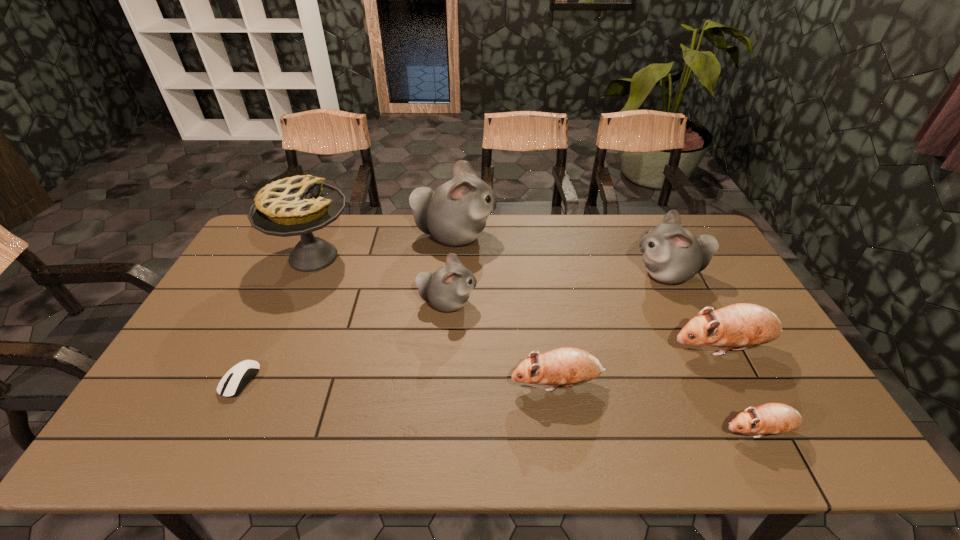
Where is `vacant region located at the face of the biggest brown hamster`? vacant region located at the face of the biggest brown hamster is located at coordinates (523, 348).

Identify the location of vacant space located 0.060m at the face of the biggest brown hamster. (647, 348).

The image size is (960, 540). I want to click on free location located at the face of the biggest brown hamster, so pyautogui.click(x=629, y=348).

This screenshot has width=960, height=540. I want to click on free space located 0.160m at the face of the leftmost brown hamster, so click(x=447, y=383).

I want to click on vacant space located 0.380m at the face of the leftmost brown hamster, so click(362, 383).

Find the location of a particular element. The image size is (960, 540). vacant position located at the face of the leftmost brown hamster is located at coordinates (397, 383).

Where is `vacant area located 0.220m at the face of the nearest brown hamster`? The width and height of the screenshot is (960, 540). vacant area located 0.220m at the face of the nearest brown hamster is located at coordinates (627, 431).

The width and height of the screenshot is (960, 540). I want to click on vacant space located 0.250m at the face of the nearest brown hamster, so click(614, 431).

Where is `vacant space positioned 0.240m at the face of the nearest brown hamster`? vacant space positioned 0.240m at the face of the nearest brown hamster is located at coordinates (618, 431).

I want to click on vacant space situated 0.310m on the back of the shortest object, so click(x=286, y=284).